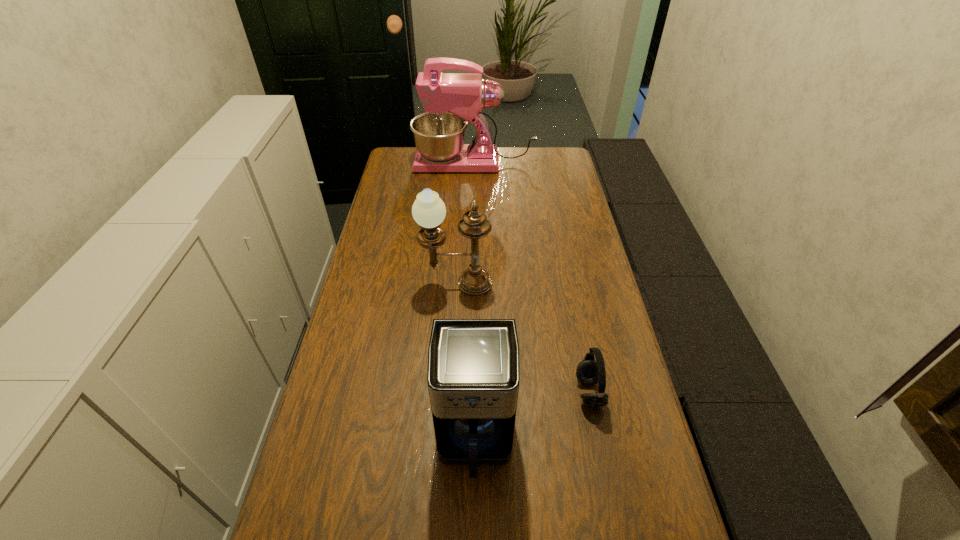
I want to click on blank space located on the ear cups of the shortest object, so click(553, 392).

The width and height of the screenshot is (960, 540). Identify the location of object that is at the far edge. (451, 100).

The height and width of the screenshot is (540, 960). Identify the location of object positioned at the left edge. (451, 100).

At what (x,y) coordinates should I click in order to perform the action: click on mixer that is at the right edge. Please return your answer as a coordinate pair (x, y). Image resolution: width=960 pixels, height=540 pixels. Looking at the image, I should click on (451, 100).

Image resolution: width=960 pixels, height=540 pixels. In order to click on headset at the right edge in this screenshot , I will do `click(589, 371)`.

At what (x,y) coordinates should I click in order to perform the action: click on object that is at the far left corner. Please return your answer as a coordinate pair (x, y). The height and width of the screenshot is (540, 960). Looking at the image, I should click on (451, 100).

Image resolution: width=960 pixels, height=540 pixels. What are the coordinates of `object at the far right corner` in the screenshot? It's located at (451, 100).

This screenshot has height=540, width=960. Identify the location of vacant space at the far edge. (501, 151).

The image size is (960, 540). What are the coordinates of `free point at the left edge` in the screenshot? It's located at (359, 287).

Identify the location of vacant region at the right edge of the desktop. This screenshot has width=960, height=540. (632, 403).